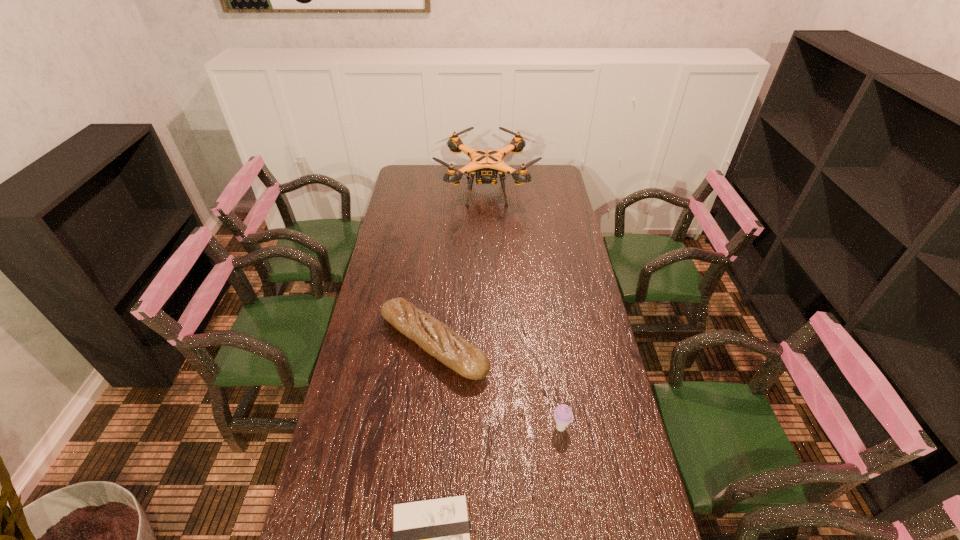
Find the location of a particular element. vacant point located between the tallest object and the icecream is located at coordinates (523, 309).

I want to click on object that is the third closest to the second nearest object, so click(x=486, y=163).

Identify the location of object that ranks as the second closest to the icecream. (431, 539).

I want to click on vacant area that satisfies the following two spatial constraints: 1. on the back side of the icecream; 2. on the camera mount of the drone, so click(527, 191).

Where is `vacant region that satisfies the following two spatial constraints: 1. on the camera mount of the third farthest object; 2. on the left side of the tallest object`? Image resolution: width=960 pixels, height=540 pixels. vacant region that satisfies the following two spatial constraints: 1. on the camera mount of the third farthest object; 2. on the left side of the tallest object is located at coordinates (492, 428).

Where is `vacant space that satisfies the following two spatial constraints: 1. on the camera mount of the second tallest object; 2. on the left side of the drone`? The height and width of the screenshot is (540, 960). vacant space that satisfies the following two spatial constraints: 1. on the camera mount of the second tallest object; 2. on the left side of the drone is located at coordinates (492, 428).

You are a GUI agent. You are given a task and a screenshot of the screen. Output one action in this format:
    pyautogui.click(x=<x>, y=<y>)
    Task: Click on the vacant space that satisfies the following two spatial constraints: 1. on the camera mount of the third farthest object; 2. on the right side of the farthest object
    The image size is (960, 540).
    Given the screenshot: What is the action you would take?
    pyautogui.click(x=492, y=428)